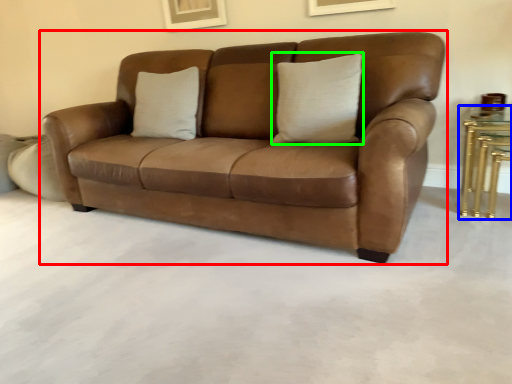
Question: Which object is the farthest from studio couch (highlighted by a red box)? Choose among these: table (highlighted by a blue box) or pillow (highlighted by a green box).

Choices:
 (A) table
 (B) pillow

Answer: (A)